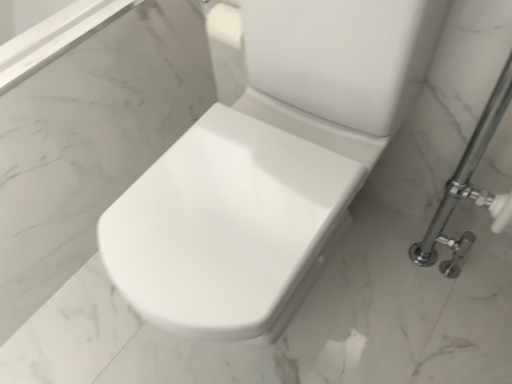
What are the coordinates of `free region on the left part of chrome/metallic shower at right` in the screenshot? It's located at (385, 313).